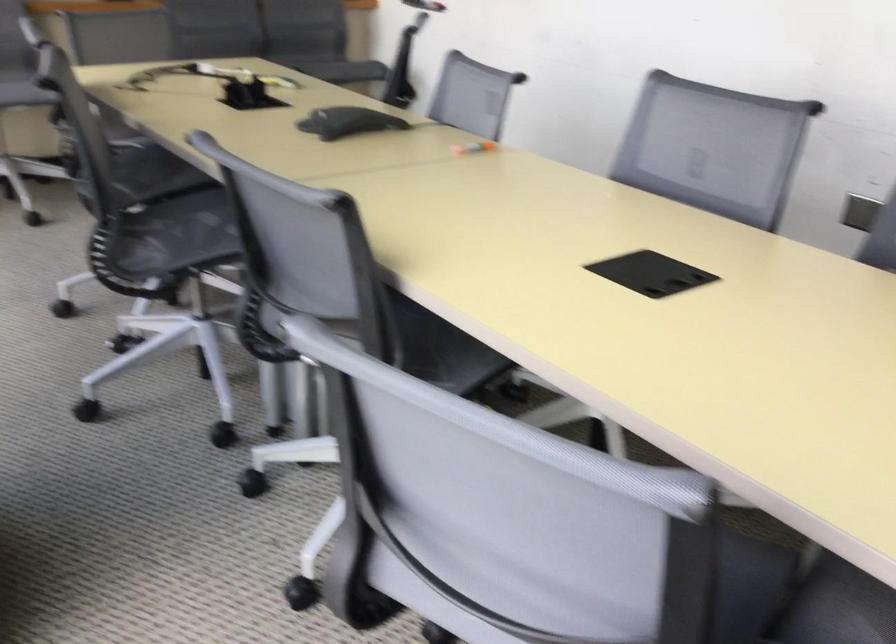
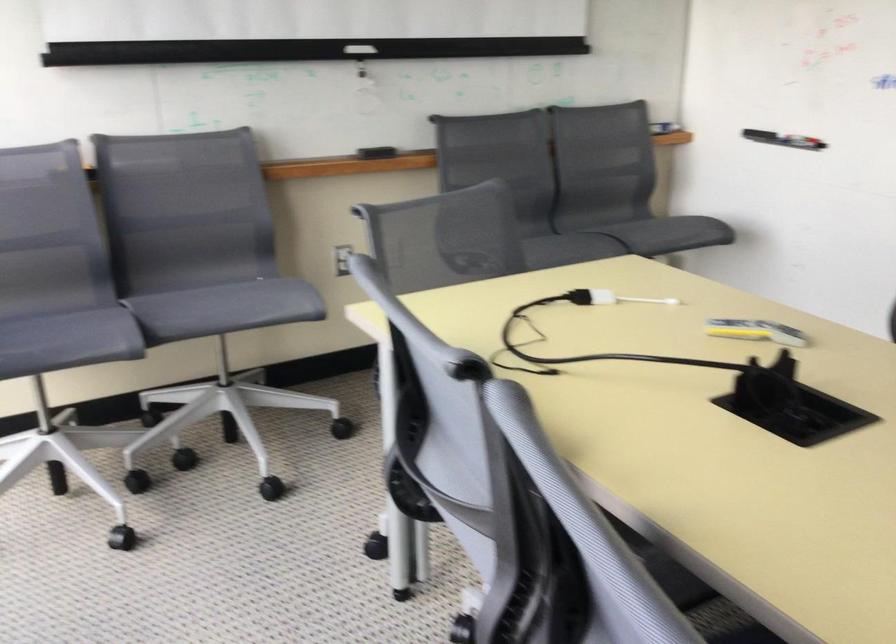
Where in the second image is the point corresponding to (x=280, y=84) from the first image?

(755, 330)